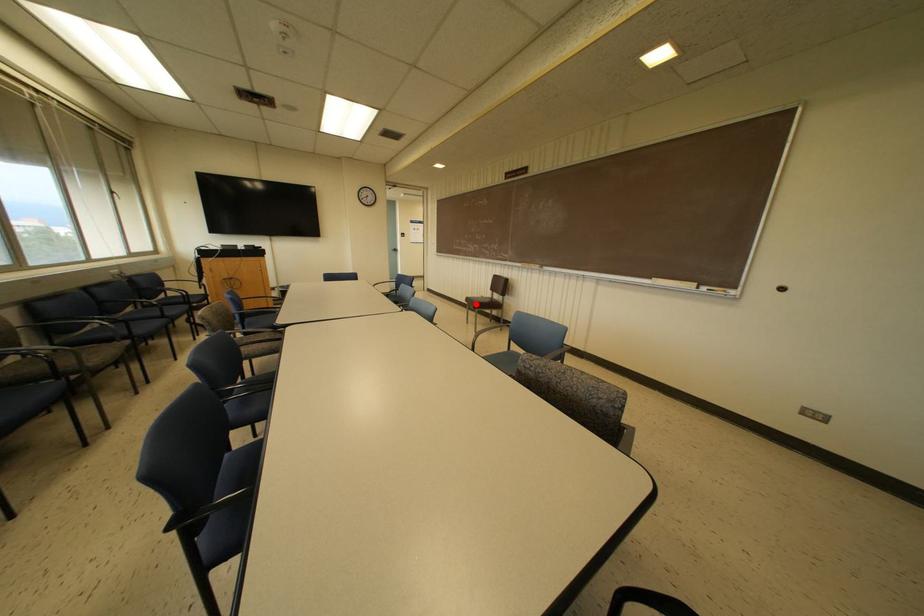
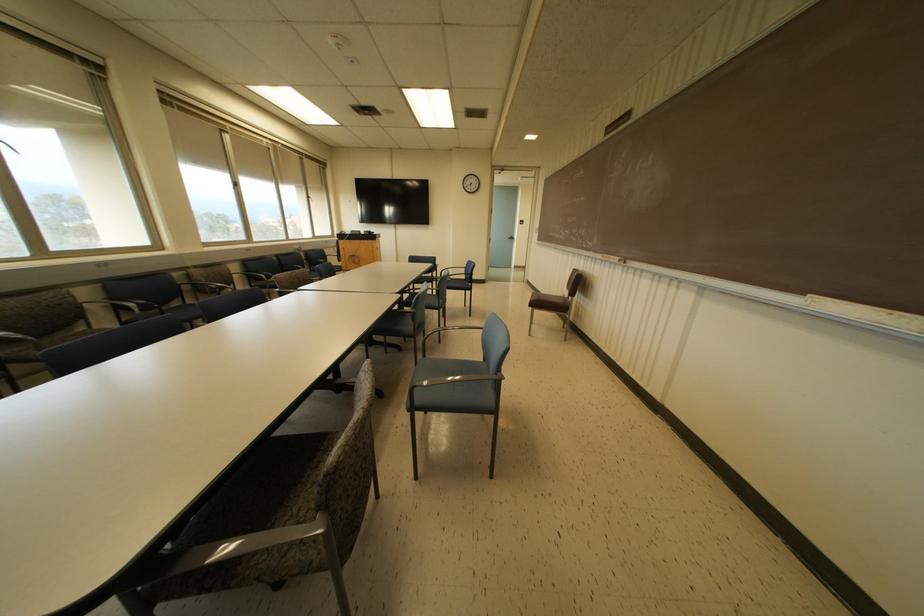
Locate, in the second image, the point that corresponds to the highlighted location in the first image.

(540, 302)